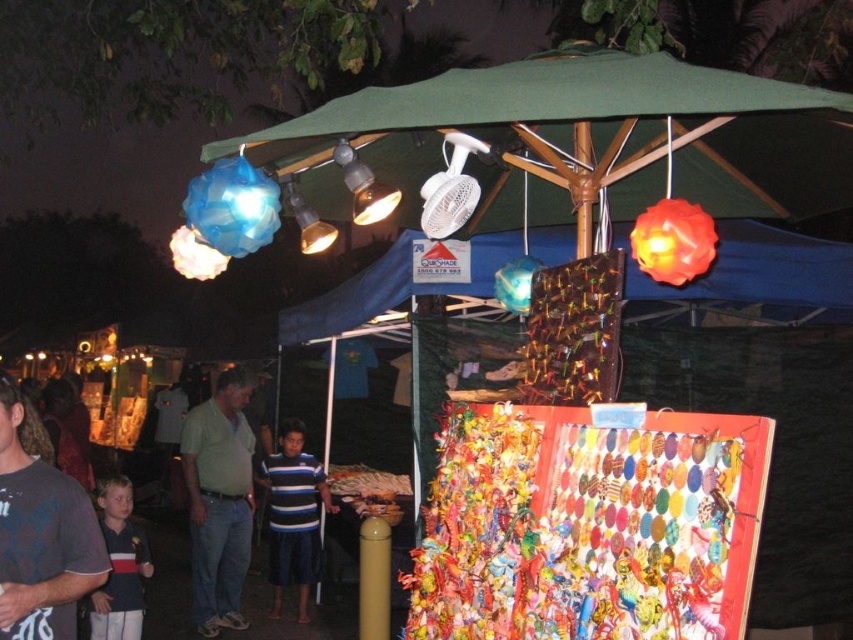
Question: Can you confirm if green cotton shirt at center is thinner than blue striped shirt at center?

Choices:
 (A) yes
 (B) no

Answer: (A)

Question: Is matte gray shirt at center positioned at the back of blue striped shirt at center?

Choices:
 (A) yes
 (B) no

Answer: (B)

Question: Which point is closer to the camera taking this photo?

Choices:
 (A) (45, 497)
 (B) (274, 486)

Answer: (A)

Question: Which object appears farthest from the camera in this image?

Choices:
 (A) blue striped shirt at center
 (B) matte gray shirt at center

Answer: (A)

Question: Can you confirm if matte gray shirt at center is positioned above blue striped shirt at center?

Choices:
 (A) yes
 (B) no

Answer: (A)

Question: Which point is closer to the camera?

Choices:
 (A) matte gray shirt at center
 (B) blue striped shirt at center

Answer: (A)